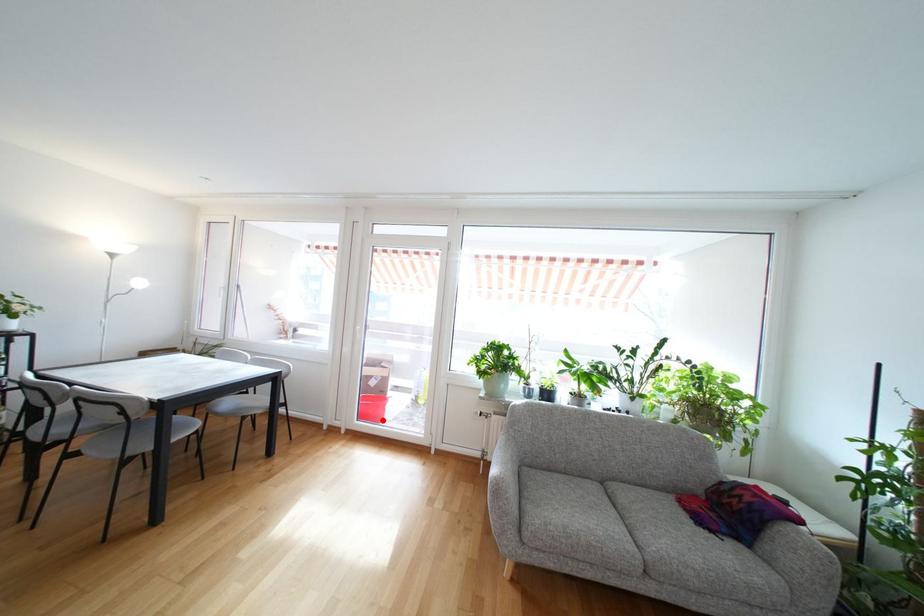
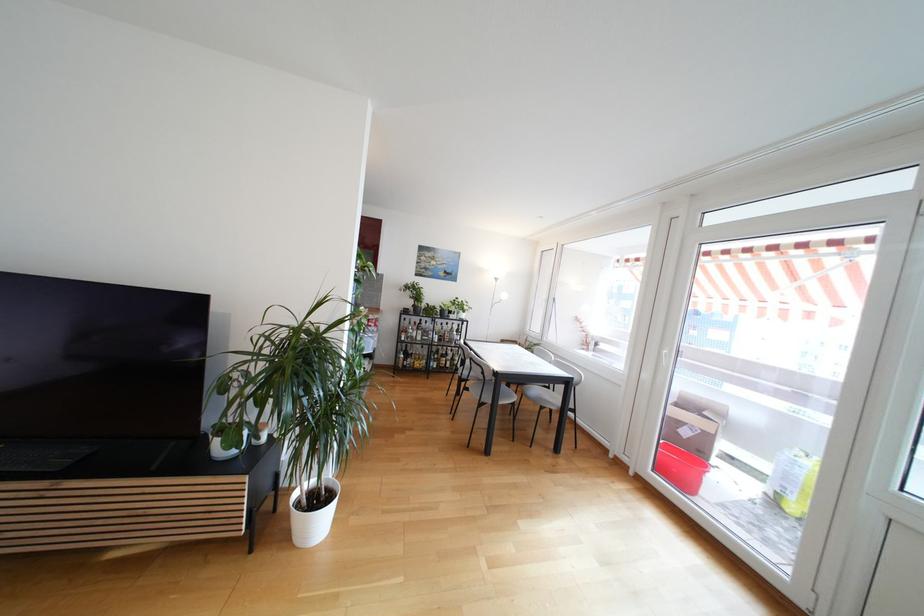
In the second image, find the point that corresponds to the highlighted location in the first image.

(691, 488)